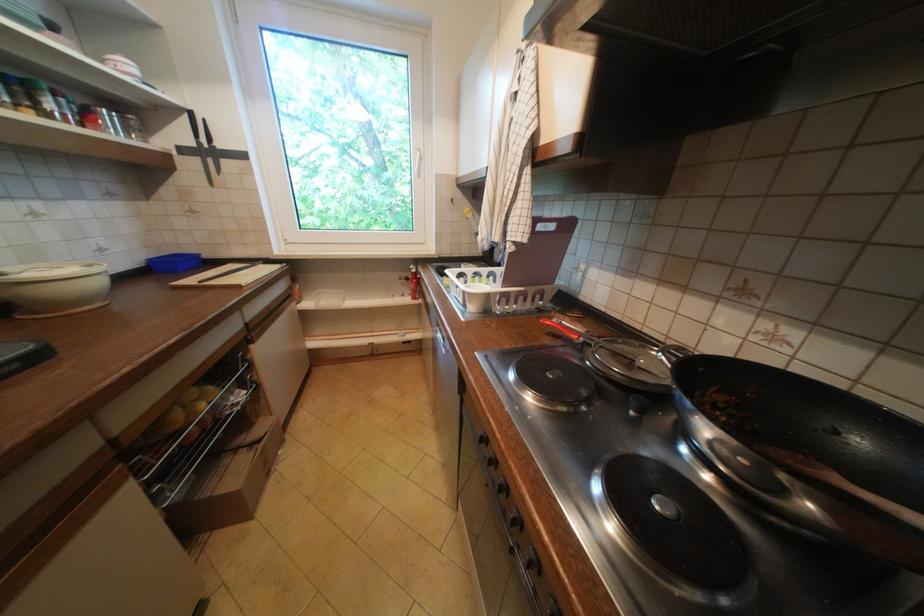
What do you see at coordinates (565, 330) in the screenshot? I see `a red strainer handle` at bounding box center [565, 330].